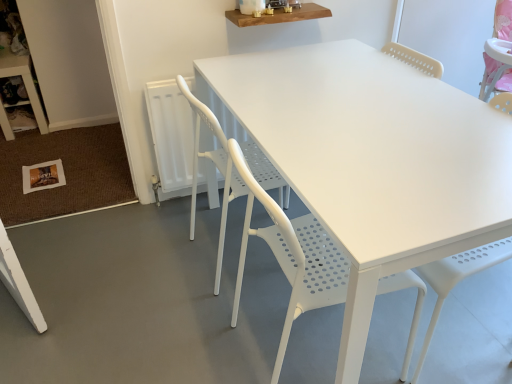
Question: Which direction should I rotate to look at white perforated plastic chair at center, arranged as the first chair when viewed from the front, — up or down?

Choices:
 (A) down
 (B) up

Answer: (A)

Question: Considering the relative sizes of white perforated plastic chair at center, arranged as the first chair when viewed from the front, and white plastic table at lower left, positioned as the second table in front-to-back order, in the image provided, is white perforated plastic chair at center, arranged as the first chair when viewed from the front, taller than white plastic table at lower left, positioned as the second table in front-to-back order,?

Choices:
 (A) no
 (B) yes

Answer: (B)

Question: From the image's perspective, is white perforated plastic chair at center, which is the 2th chair from back to front, over white plastic table at lower left, which appears as the 1th table when viewed from the back?

Choices:
 (A) no
 (B) yes

Answer: (A)

Question: From the image's perspective, does white perforated plastic chair at center, which is the 2th chair from back to front, appear lower than white plastic table at lower left, positioned as the second table in right-to-left order?

Choices:
 (A) no
 (B) yes

Answer: (B)

Question: Can you confirm if white perforated plastic chair at center, arranged as the first chair when viewed from the front, is smaller than white plastic table at lower left, positioned as the second table in front-to-back order?

Choices:
 (A) no
 (B) yes

Answer: (A)

Question: From a real-world perspective, is white perforated plastic chair at center, arranged as the first chair when viewed from the front, located beneath white plastic table at lower left, positioned as the second table in right-to-left order?

Choices:
 (A) no
 (B) yes

Answer: (A)

Question: Can you confirm if white perforated plastic chair at center, which is the 2th chair from back to front, is thinner than white plastic table at lower left, positioned as the second table in right-to-left order?

Choices:
 (A) yes
 (B) no

Answer: (B)

Question: Is wooden shelf at upper center, which appears as the first table when viewed from the right, oriented away from white perforated plastic chair at center, arranged as the first chair when viewed from the front?

Choices:
 (A) no
 (B) yes

Answer: (A)

Question: Is wooden shelf at upper center, which appears as the first table when viewed from the right, not within white perforated plastic chair at center, which is the 2th chair from back to front?

Choices:
 (A) yes
 (B) no

Answer: (A)

Question: Can you confirm if wooden shelf at upper center, placed as the 1th table when sorted from front to back, is wider than white perforated plastic chair at center, arranged as the first chair when viewed from the front?

Choices:
 (A) no
 (B) yes

Answer: (A)

Question: Is wooden shelf at upper center, arranged as the second table when viewed from the back, further to the viewer compared to white perforated plastic chair at center, arranged as the first chair when viewed from the front?

Choices:
 (A) no
 (B) yes

Answer: (B)

Question: From a real-world perspective, is wooden shelf at upper center, placed as the 1th table when sorted from front to back, under white perforated plastic chair at center, arranged as the first chair when viewed from the front?

Choices:
 (A) no
 (B) yes

Answer: (A)

Question: Is wooden shelf at upper center, placed as the 1th table when sorted from front to back, far away from white perforated plastic chair at center, which is the 2th chair from back to front?

Choices:
 (A) yes
 (B) no

Answer: (B)

Question: Is there a large distance between wooden shelf at upper center, which is counted as the second table, starting from the left, and white plastic table at lower left, positioned as the second table in right-to-left order?

Choices:
 (A) no
 (B) yes

Answer: (B)